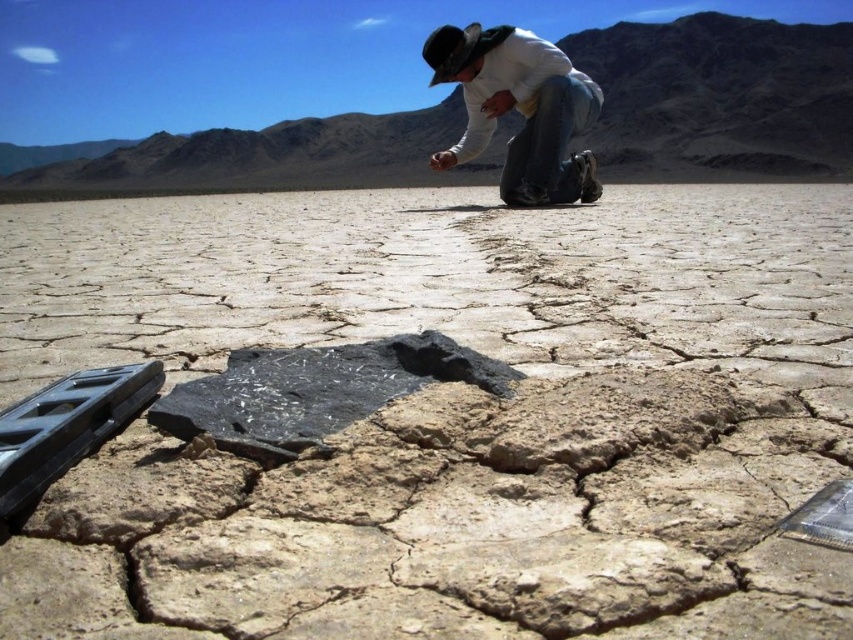
You are a hiker who wants to reach the black matte rock at center from your current position near the denim jeans at center. Given that you can only move in straight lines and your maximum comfortable walking distance is 7 meters, can you safely reach the rock without straining yourself?

The distance between the black matte rock at center and denim jeans at center is 7.29 meters, which exceeds your maximum comfortable walking distance of 7 meters. Therefore, you cannot safely reach the rock without straining yourself.

You are a geologist in the desert, and you see the black matte rock at center and the denim jeans at center. Which object is positioned to the left of the other?

The black matte rock at center is to the left of denim jeans at center.